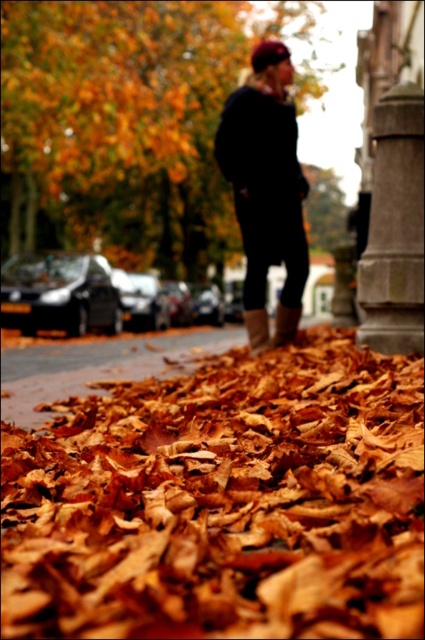
You are standing in an autumn scene with golden leaves at center and a gray stone pillar at right. Which object is taller?

The golden leaves at center are taller than the gray stone pillar at right.

You are a fashion designer observing the autumn scene. You see the dark blue sweater at center and the leather boot at lower center. Which item of clothing is positioned higher in the image?

The dark blue sweater at center is much taller than the leather boot at lower center, so the dark blue sweater at center is positioned higher in the image.

You are an artist planning to paint the autumn scene. You want to ensure the dark blue sweater at center and the leather boot at lower center are proportionally accurate. Which object should you make larger in your painting?

The dark blue sweater at center should be made larger in the painting since it has a larger size compared to the leather boot at lower center according to the description.